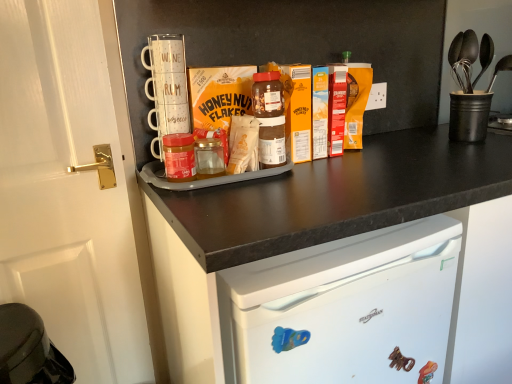
The height and width of the screenshot is (384, 512). Find the location of `vacant space in front of black matte cup at upper right`. vacant space in front of black matte cup at upper right is located at coordinates (484, 149).